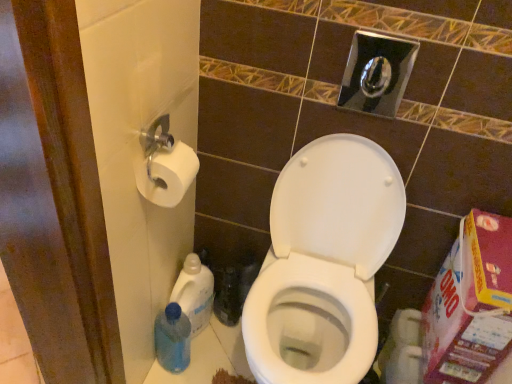
Question: From a real-world perspective, is white glossy toilet at center positioned under blue plastic bottle at lower left, acting as the 1th cleaning product starting from the bottom, based on gravity?

Choices:
 (A) yes
 (B) no

Answer: (B)

Question: Is white glossy toilet at center taller than blue plastic bottle at lower left, which ranks as the 2th cleaning product in top-to-bottom order?

Choices:
 (A) yes
 (B) no

Answer: (A)

Question: From the image's perspective, does white glossy toilet at center appear lower than blue plastic bottle at lower left, which ranks as the 2th cleaning product in top-to-bottom order?

Choices:
 (A) no
 (B) yes

Answer: (A)

Question: From a real-world perspective, is white glossy toilet at center on top of blue plastic bottle at lower left, acting as the 1th cleaning product starting from the bottom?

Choices:
 (A) no
 (B) yes

Answer: (B)

Question: Considering the relative sizes of white glossy toilet at center and blue plastic bottle at lower left, which ranks as the 2th cleaning product in top-to-bottom order, in the image provided, is white glossy toilet at center thinner than blue plastic bottle at lower left, which ranks as the 2th cleaning product in top-to-bottom order,?

Choices:
 (A) no
 (B) yes

Answer: (A)

Question: Can you confirm if white glossy toilet at center is positioned to the left of blue plastic bottle at lower left, which ranks as the 2th cleaning product in top-to-bottom order?

Choices:
 (A) no
 (B) yes

Answer: (A)

Question: Can you confirm if white glossy toilet at center is positioned to the right of translucent plastic bottle at lower left, acting as the second cleaning product starting from the bottom?

Choices:
 (A) yes
 (B) no

Answer: (A)

Question: Is white glossy toilet at center completely or partially outside of translucent plastic bottle at lower left, acting as the second cleaning product starting from the bottom?

Choices:
 (A) yes
 (B) no

Answer: (A)

Question: Is white glossy toilet at center turned away from translucent plastic bottle at lower left, positioned as the first cleaning product in top-to-bottom order?

Choices:
 (A) no
 (B) yes

Answer: (A)

Question: From the image's perspective, is white glossy toilet at center on top of translucent plastic bottle at lower left, positioned as the first cleaning product in top-to-bottom order?

Choices:
 (A) yes
 (B) no

Answer: (A)

Question: Is white glossy toilet at center not close to translucent plastic bottle at lower left, positioned as the first cleaning product in top-to-bottom order?

Choices:
 (A) no
 (B) yes

Answer: (A)

Question: Is the position of white glossy toilet at center more distant than that of translucent plastic bottle at lower left, acting as the second cleaning product starting from the bottom?

Choices:
 (A) yes
 (B) no

Answer: (B)

Question: Does white matte toilet paper at left have a smaller size compared to white glossy toilet at center?

Choices:
 (A) no
 (B) yes

Answer: (B)